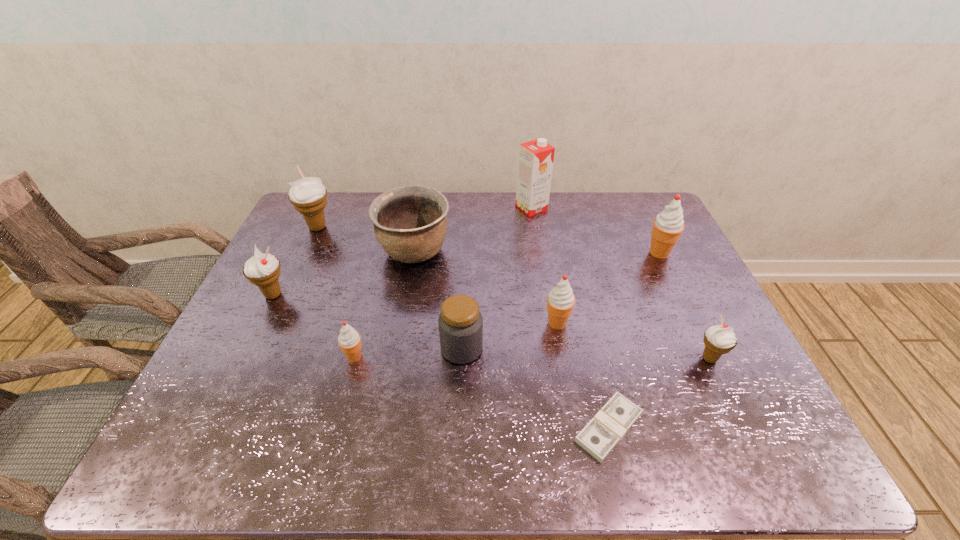
Image resolution: width=960 pixels, height=540 pixels. Find the location of `white icecream that is the third nearest to the shortest object`. white icecream that is the third nearest to the shortest object is located at coordinates (308, 195).

Locate an element on the screen. The width and height of the screenshot is (960, 540). white icecream that is the third closest one to the biggest red icecream is located at coordinates (263, 270).

You are a GUI agent. You are given a task and a screenshot of the screen. Output one action in this format:
    pyautogui.click(x=<x>, y=<y>)
    Task: Click on the closest red icecream relative to the leftmost red icecream
    The image size is (960, 540).
    Given the screenshot: What is the action you would take?
    pyautogui.click(x=560, y=301)

Locate which red icecream is the closest to the second nearest red icecream. Please provide its 2D coordinates. Your answer should be formatted as a tuple, i.e. [(x, y)], where the tuple contains the x and y coordinates of a point satisfying the conditions above.

[(668, 225)]

I want to click on free space that satisfies the following two spatial constraints: 1. on the front side of the second nearest white icecream; 2. on the left side of the shortest object, so click(207, 428).